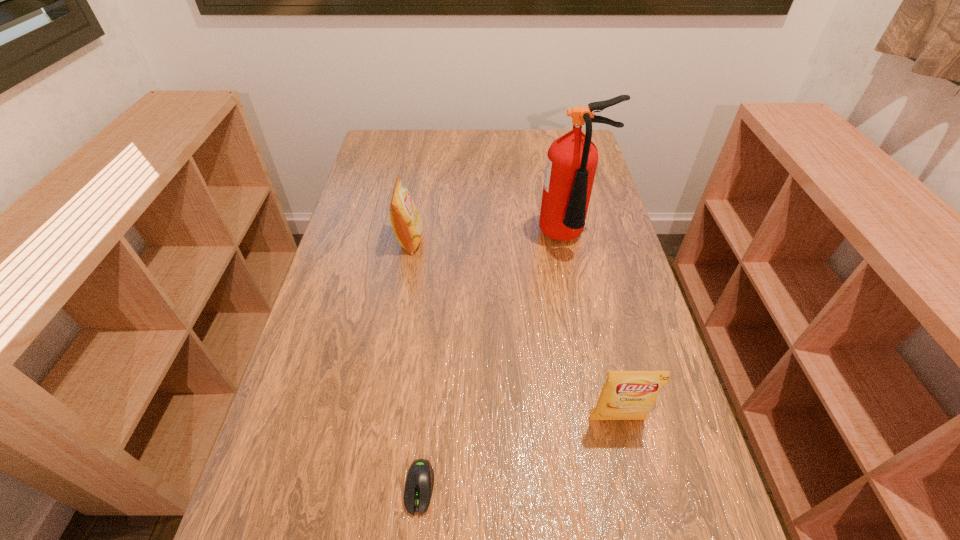
This screenshot has width=960, height=540. I want to click on unoccupied position between the shortest object and the third farthest object, so click(x=518, y=454).

Find the location of `free space between the farther crisp (potato chip) and the right crisp (potato chip)`. free space between the farther crisp (potato chip) and the right crisp (potato chip) is located at coordinates (514, 330).

Find the location of a particular element. This screenshot has height=540, width=960. free spot between the right crisp (potato chip) and the second object from left to right is located at coordinates (518, 454).

Locate an element on the screen. vacant point located between the computer mouse and the tallest object is located at coordinates (494, 363).

At what (x,y) coordinates should I click in order to perform the action: click on empty space that is in between the tallest object and the third farthest object. Please return your answer as a coordinate pair (x, y). This screenshot has height=540, width=960. Looking at the image, I should click on (593, 329).

This screenshot has height=540, width=960. In order to click on free area in between the tallest object and the computer mouse in this screenshot , I will do `click(494, 363)`.

Where is `the third closest object to the nearer crisp (potato chip)`? the third closest object to the nearer crisp (potato chip) is located at coordinates (407, 224).

Choose which object is the third nearest neighbor to the fire extinguisher. Please provide its 2D coordinates. Your answer should be formatted as a tuple, i.e. [(x, y)], where the tuple contains the x and y coordinates of a point satisfying the conditions above.

[(419, 483)]

Find the location of a particular element. vacant region that satisfies the following two spatial constraints: 1. at the nozzle of the fire extinguisher; 2. on the front-facing side of the leftmost object is located at coordinates (570, 241).

Locate an element on the screen. The width and height of the screenshot is (960, 540). vacant space that satisfies the following two spatial constraints: 1. at the nozzle of the tallest object; 2. on the front-facing side of the farther crisp (potato chip) is located at coordinates (570, 241).